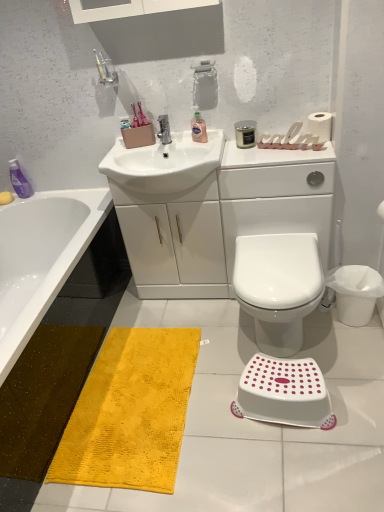
Question: From the image's perspective, is white glossy sink at center located above matte white bathtub at lower left?

Choices:
 (A) no
 (B) yes

Answer: (B)

Question: Is white glossy sink at center in front of matte white bathtub at lower left?

Choices:
 (A) no
 (B) yes

Answer: (A)

Question: Is white glossy sink at center positioned with its back to matte white bathtub at lower left?

Choices:
 (A) no
 (B) yes

Answer: (A)

Question: Is white glossy sink at center to the left of matte white bathtub at lower left from the viewer's perspective?

Choices:
 (A) no
 (B) yes

Answer: (A)

Question: Is white glossy sink at center completely or partially outside of matte white bathtub at lower left?

Choices:
 (A) no
 (B) yes

Answer: (B)

Question: From the image's perspective, is white glossy sink at center located beneath matte white bathtub at lower left?

Choices:
 (A) yes
 (B) no

Answer: (B)

Question: From the image's perspective, is white plastic step stool at lower right located beneath white glossy toilet at center?

Choices:
 (A) no
 (B) yes

Answer: (B)

Question: Is white plastic step stool at lower right oriented away from white glossy toilet at center?

Choices:
 (A) no
 (B) yes

Answer: (B)

Question: Is white plastic step stool at lower right located outside white glossy toilet at center?

Choices:
 (A) yes
 (B) no

Answer: (A)

Question: Considering the relative sizes of white plastic step stool at lower right and white glossy toilet at center in the image provided, is white plastic step stool at lower right wider than white glossy toilet at center?

Choices:
 (A) yes
 (B) no

Answer: (B)

Question: Can you confirm if white plastic step stool at lower right is positioned to the right of white glossy toilet at center?

Choices:
 (A) no
 (B) yes

Answer: (A)

Question: From the image's perspective, is white plastic step stool at lower right located above white glossy toilet at center?

Choices:
 (A) yes
 (B) no

Answer: (B)

Question: Considering the relative positions of translucent pink liquid at sink, arranged as the 2th toiletry when ordered from the bottom, and white glossy cabinet at center in the image provided, is translucent pink liquid at sink, arranged as the 2th toiletry when ordered from the bottom, to the left of white glossy cabinet at center from the viewer's perspective?

Choices:
 (A) no
 (B) yes

Answer: (B)